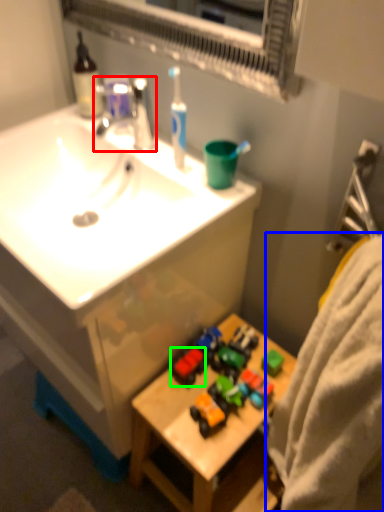
Question: Based on their relative distances, which object is farther from tap (highlighted by a red box)? Choose from bath towel (highlighted by a blue box) and toy (highlighted by a green box).

Choices:
 (A) bath towel
 (B) toy

Answer: (A)